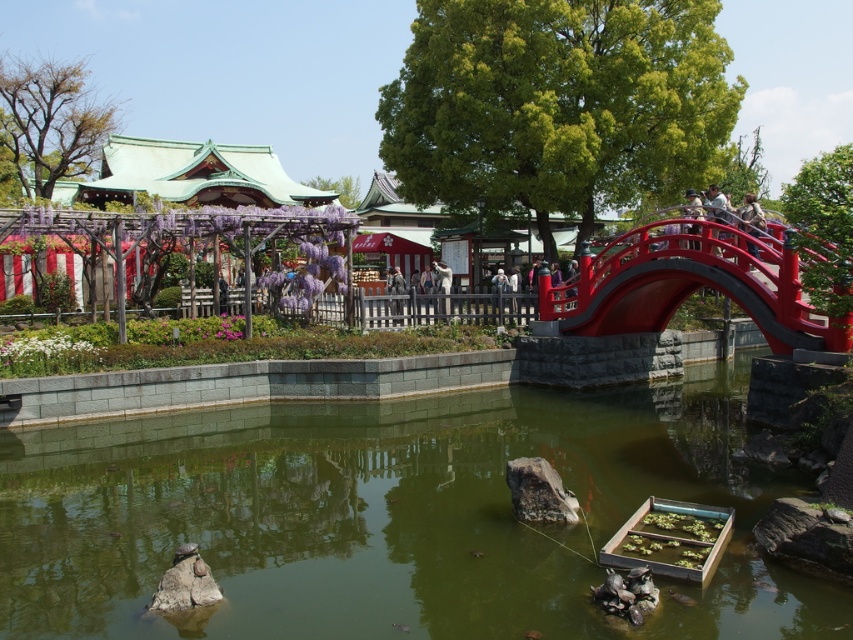
Does glossy wood bridge at center right have a greater width compared to green stone wall at center?

Incorrect, glossy wood bridge at center right's width does not surpass green stone wall at center's.

Does glossy wood bridge at center right have a greater height compared to green stone wall at center?

Yes.

Between point (764, 268) and point (241, 358), which one is positioned behind?

The point (241, 358) is more distant.

The height and width of the screenshot is (640, 853). I want to click on glossy wood bridge at center right, so coord(689,284).

Looking at this image, is greenish water at pond center below glossy wood bridge at center right?

Indeed, greenish water at pond center is positioned under glossy wood bridge at center right.

Image resolution: width=853 pixels, height=640 pixels. What do you see at coordinates (389, 516) in the screenshot? I see `greenish water at pond center` at bounding box center [389, 516].

Locate an element on the screen. greenish water at pond center is located at coordinates (389, 516).

The height and width of the screenshot is (640, 853). Find the location of `greenish water at pond center`. greenish water at pond center is located at coordinates (389, 516).

Is glossy wood bridge at center right thinner than camouflage jacket at upper right?

Yes.

Is glossy wood bridge at center right to the left of camouflage jacket at upper right from the viewer's perspective?

Correct, you'll find glossy wood bridge at center right to the left of camouflage jacket at upper right.

Where is `glossy wood bridge at center right`? The image size is (853, 640). glossy wood bridge at center right is located at coordinates (689, 284).

The image size is (853, 640). I want to click on glossy wood bridge at center right, so click(689, 284).